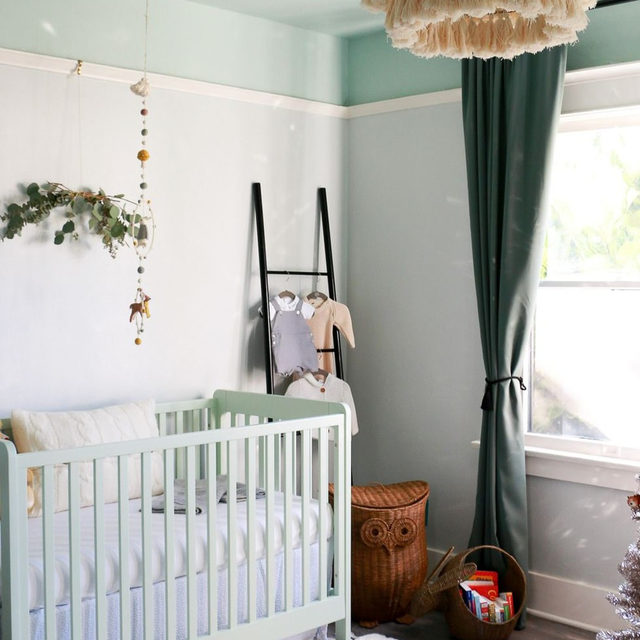
Image resolution: width=640 pixels, height=640 pixels. What are the coordinates of `basket` in the screenshot? It's located at (390, 564).